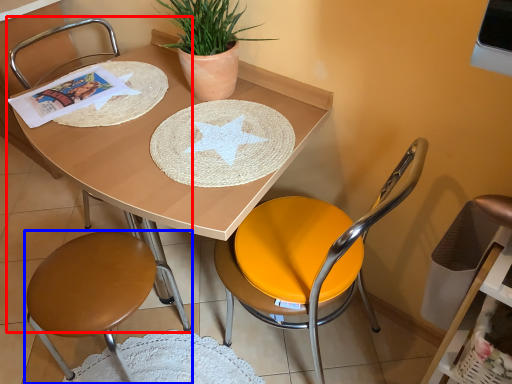
Question: Which object is further to the camera taking this photo, chair (highlighted by a red box) or chair (highlighted by a blue box)?

Choices:
 (A) chair
 (B) chair

Answer: (A)